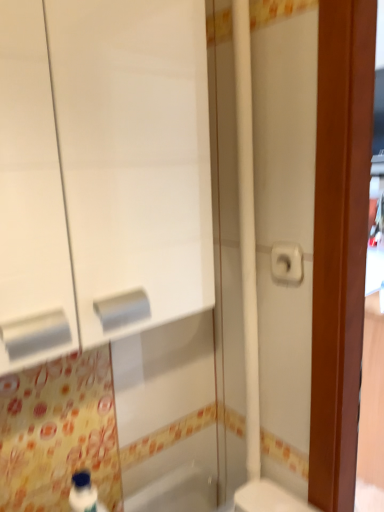
Question: Is white matte toilet paper at right taller or shorter than white matte cabinet at left?

Choices:
 (A) short
 (B) tall

Answer: (A)

Question: Considering the positions of white matte toilet paper at right and white matte cabinet at left in the image, is white matte toilet paper at right bigger or smaller than white matte cabinet at left?

Choices:
 (A) big
 (B) small

Answer: (B)

Question: Estimate the real-world distances between objects in this image. Which object is closer to the white matte toilet paper at right?

Choices:
 (A) white matte cabinet at left
 (B) white glossy toilet at lower right
 (C) white glossy bathtub at lower center

Answer: (A)

Question: Which is farther from the white glossy toilet at lower right?

Choices:
 (A) white matte cabinet at left
 (B) white matte toilet paper at right
 (C) white glossy bathtub at lower center

Answer: (A)